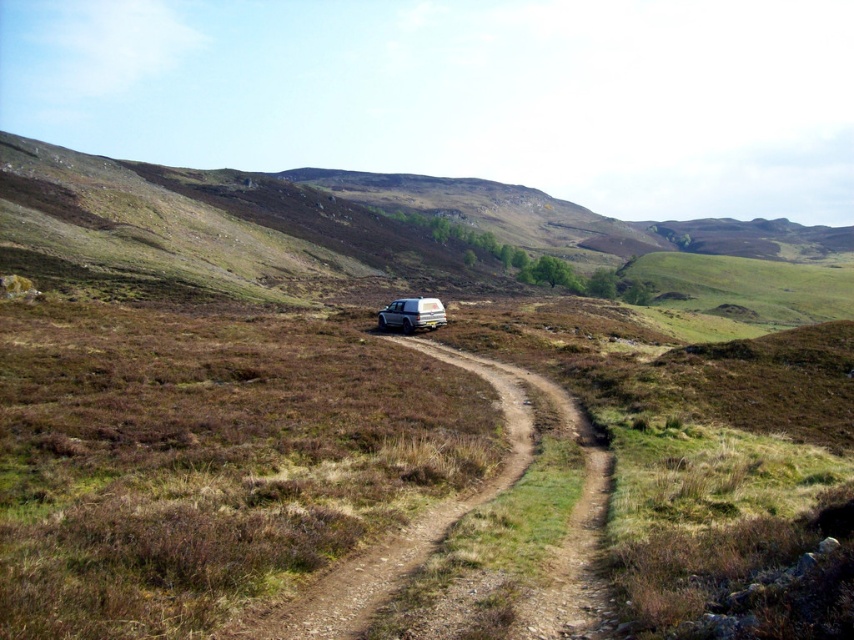
You are a hiker standing at the starting point of the brown dirt trail at center and want to reach the silver metallic jeep at center. Which direction should you walk to get closer to the jeep?

The silver metallic jeep at center is further away from the viewer compared to the brown dirt trail at center. To reach the jeep, you should walk forward along the dirt trail towards the horizon where the trail leads to the jeep.

You are a hiker trying to decide whether to cross the brown dirt trail at center using your 2m tall tent. Can your tent fit vertically through the space under the silver metallic jeep at center along the trail?

The brown dirt trail at center is not as tall as silver metallic jeep at center, meaning the trail is shorter in height than the jeep. Therefore, the 2m tall tent may not fit vertically under the silver metallic jeep at center since the trail itself is not tall enough to accommodate it.

You are a hiker carrying a backpack and need to reach the silver metallic jeep at center from the brown dirt trail at center. Given that your average walking speed is 3 miles per hour, how many minutes will it take you to reach the jeep?

The distance between the brown dirt trail at center and the silver metallic jeep at center is 83.91 feet. Converting this to miles, 83.91 feet is approximately 0.016 miles. At a walking speed of 3 mph, the time required is roughly 0.016 miles divided by 3 mph, which equals approximately 0.0053 hours. Converting hours to minutes by multiplying by 60 gives about 0.32 minutes, or roughly 19 seconds. Therefore, it would take approximately 0.32 minutes to reach the jeep.